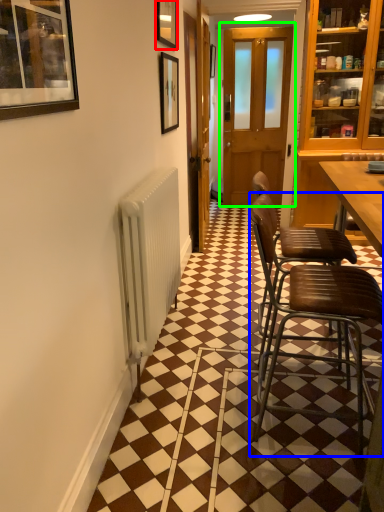
Question: Estimate the real-world distances between objects in this image. Which object is closer to picture frame (highlighted by a red box), chair (highlighted by a blue box) or door (highlighted by a green box)?

Choices:
 (A) chair
 (B) door

Answer: (A)